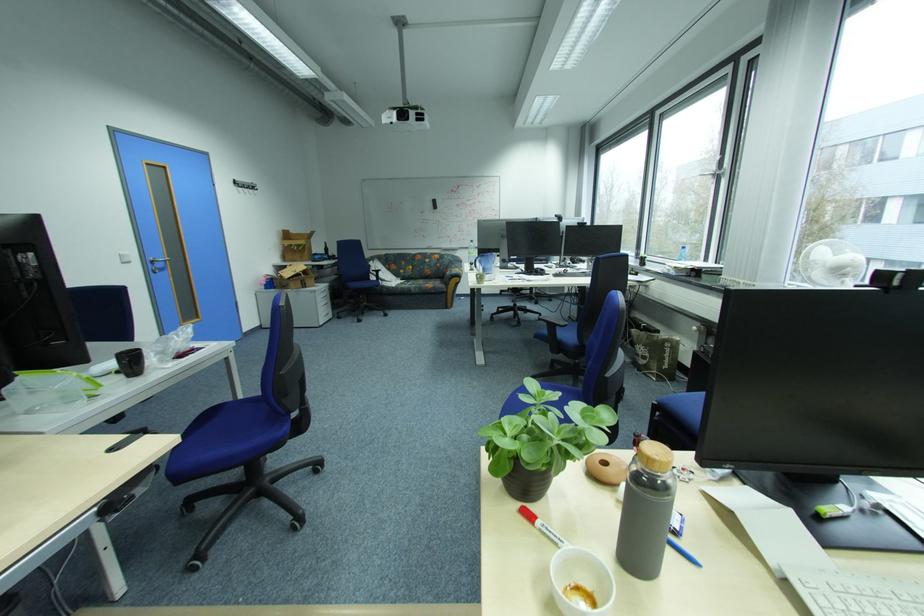
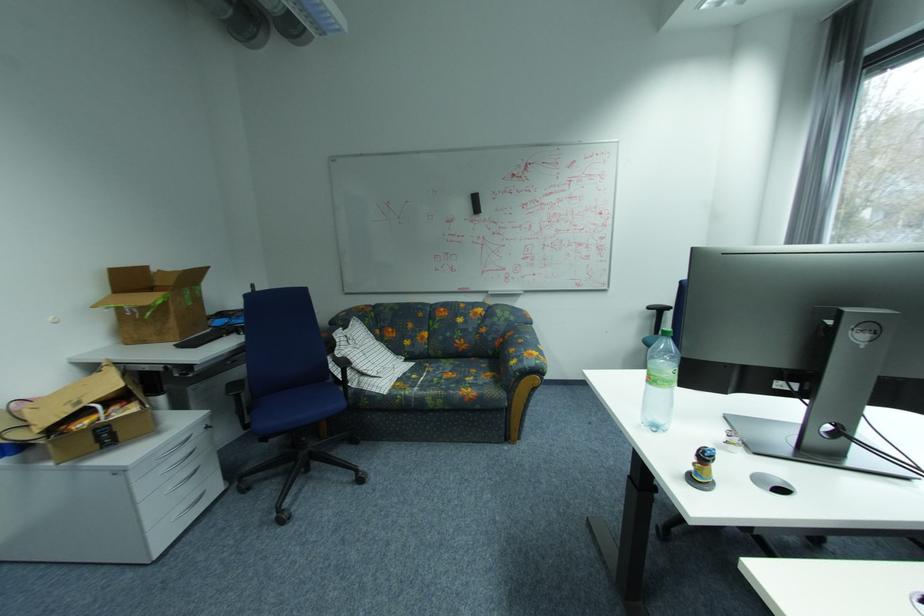
Question: What movement of the cameraman would produce the second image?

Choices:
 (A) Left
 (B) Right
 (C) Forward
 (D) Backward

Answer: (C)